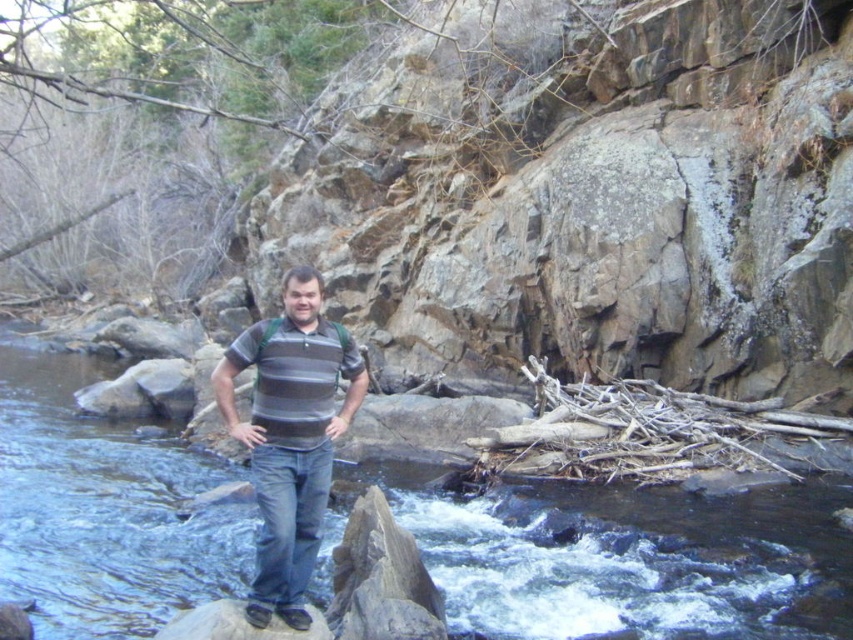
Looking at this image, based on the scene, can you determine which object is smaller in size between the clear water at center and the striped cotton shirt at center?

The clear water at center has a smaller size compared to the striped cotton shirt at center, so the clear water at center is smaller.